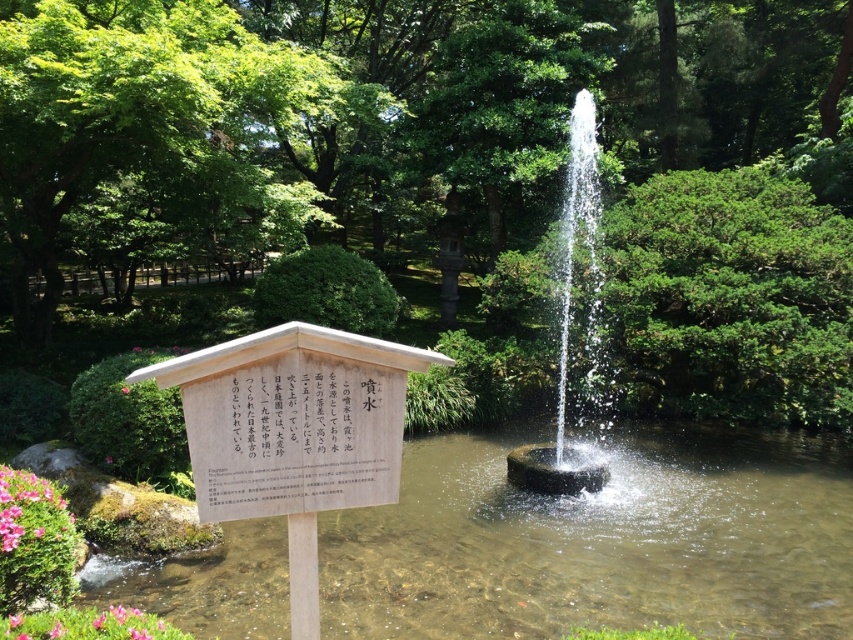
You are a visitor in the Japanese garden and want to read the white paper sign at center. To do so, you need to walk around the pink matte flower at center. Which direction should you move relative to the flower to reach the sign?

The white paper sign at center is positioned on the right side of the pink matte flower at center. Therefore, to reach the sign, you should move to the right side of the pink matte flower at center.

You are a gardener who wants to plant a new tree that is 3 meters tall. You see the green leafy tree at center and the pink matte flower at lower left in the garden. Which existing object in the garden is taller than your new tree?

The green leafy tree at center is taller than the pink matte flower at lower left, but since your new tree is 3 meters tall, the green leafy tree at center might be the one taller than it depending on its actual height. However, the given information only states that the green leafy tree at center is taller than the pink matte flower at lower left, so we cannot confirm if it is taller than the 3m tree.